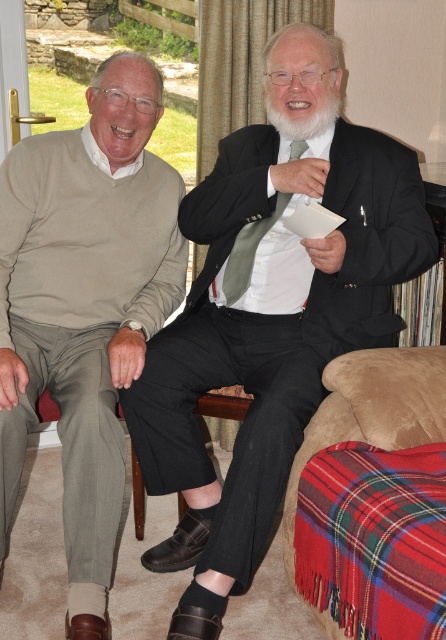
Can you confirm if light beige sweater at left is wider than whitehairbeard at center?

Correct, the width of light beige sweater at left exceeds that of whitehairbeard at center.

Where is `light beige sweater at left`? This screenshot has width=446, height=640. light beige sweater at left is located at coordinates (86, 307).

Find the location of `light beige sweater at left`. light beige sweater at left is located at coordinates (86, 307).

Identify the location of matte black suit at center. The height and width of the screenshot is (640, 446). (268, 333).

Is matte black suit at center below whitehairbeard at center?

Yes.

Which is in front, point (331, 316) or point (322, 104)?

Point (322, 104) is in front.

At what (x,y) coordinates should I click in order to perform the action: click on matte black suit at center. Please return your answer as a coordinate pair (x, y). The height and width of the screenshot is (640, 446). Looking at the image, I should click on (268, 333).

Is light beige sweater at left shorter than green silk tie at center?

No.

Identify the location of light beige sweater at left. Image resolution: width=446 pixels, height=640 pixels. (86, 307).

Between point (100, 483) and point (294, 154), which one is positioned behind?

Point (294, 154)

You are a GUI agent. You are given a task and a screenshot of the screen. Output one action in this format:
    pyautogui.click(x=<x>, y=<y>)
    Task: Click on the light beige sweater at left
    
    Given the screenshot: What is the action you would take?
    pyautogui.click(x=86, y=307)